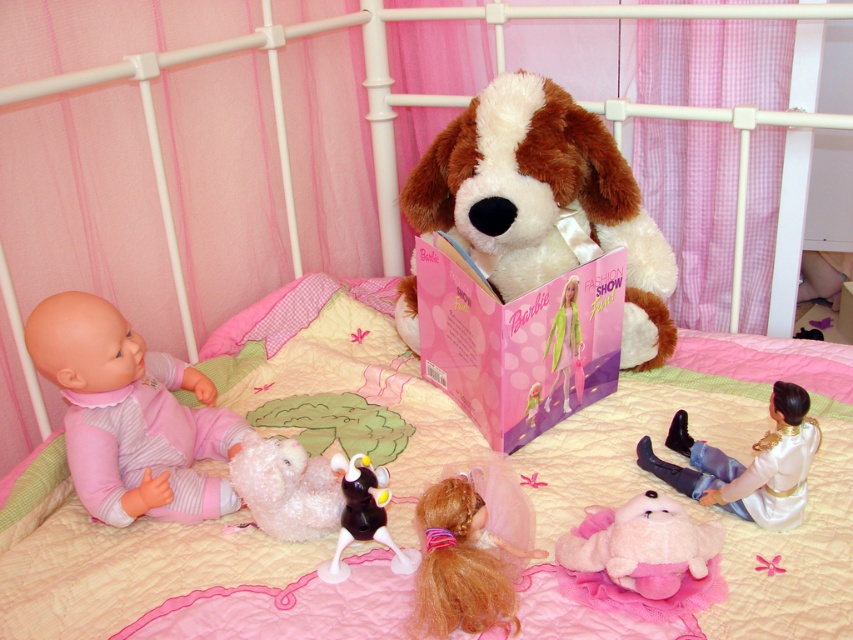
Who is positioned more to the right, fluffy brown-white teddy bear at center or shiny plastic cow at center?

From the viewer's perspective, fluffy brown-white teddy bear at center appears more on the right side.

What do you see at coordinates (544, 202) in the screenshot?
I see `fluffy brown-white teddy bear at center` at bounding box center [544, 202].

The height and width of the screenshot is (640, 853). In order to click on fluffy brown-white teddy bear at center in this screenshot , I will do [544, 202].

Consider the image. Which is above, shiny pink tulle skirt at lower center or matte pink barbie doll at center?

matte pink barbie doll at center is higher up.

Is shiny pink tulle skirt at lower center positioned before matte pink barbie doll at center?

Yes, shiny pink tulle skirt at lower center is closer to the viewer.

The image size is (853, 640). I want to click on shiny pink tulle skirt at lower center, so click(x=461, y=564).

Locate an element on the screen. The image size is (853, 640). shiny pink tulle skirt at lower center is located at coordinates (461, 564).

Is shiny plastic cow at center bigger than matte pink barbie doll at center?

Actually, shiny plastic cow at center might be smaller than matte pink barbie doll at center.

Is shiny plastic cow at center positioned in front of matte pink barbie doll at center?

Yes, shiny plastic cow at center is closer to the viewer.

What do you see at coordinates (363, 515) in the screenshot?
I see `shiny plastic cow at center` at bounding box center [363, 515].

The image size is (853, 640). I want to click on shiny plastic cow at center, so click(x=363, y=515).